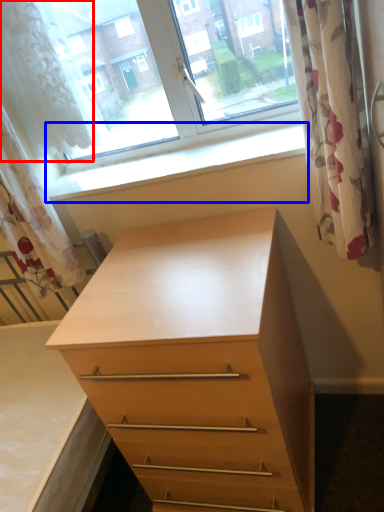
Question: Which object is further to the camera taking this photo, shower curtain (highlighted by a red box) or window sill (highlighted by a blue box)?

Choices:
 (A) shower curtain
 (B) window sill

Answer: (A)